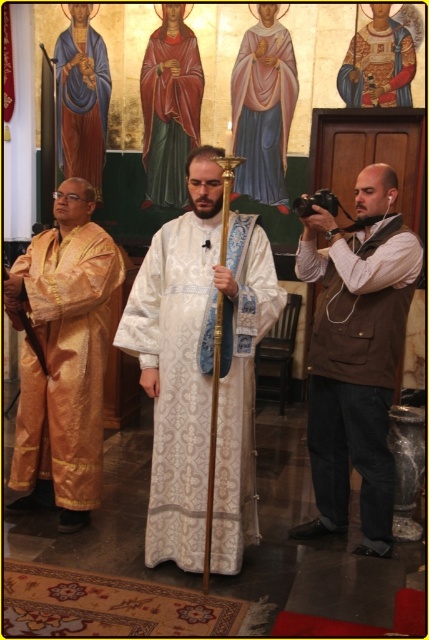
Question: Which of these objects is positioned farthest from the gold silk robe at left?

Choices:
 (A) white embroidered robe at center
 (B) gold brocade robe at upper center
 (C) pink silk robe at center

Answer: (B)

Question: Can you confirm if white embroidered robe at center is positioned to the left of brown textured vest at right?

Choices:
 (A) no
 (B) yes

Answer: (B)

Question: Can you confirm if white embroidered robe at center is positioned to the left of brown textured vest at right?

Choices:
 (A) yes
 (B) no

Answer: (A)

Question: Which object is farther from the camera taking this photo?

Choices:
 (A) pink silk robe at center
 (B) blue silk robe at upper left

Answer: (B)

Question: Is white embroidered robe at center to the right of blue silk robe at upper left from the viewer's perspective?

Choices:
 (A) yes
 (B) no

Answer: (A)

Question: Which object appears closest to the camera in this image?

Choices:
 (A) gold brocade robe at upper center
 (B) brown textured vest at right
 (C) pink silk robe at center
 (D) white embroidered robe at center

Answer: (D)